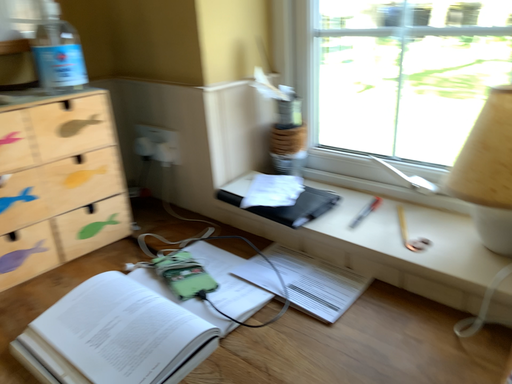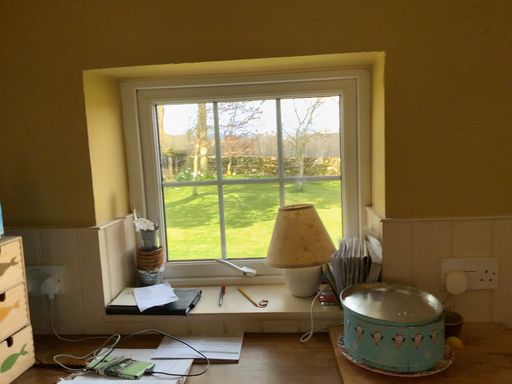
Question: Which way did the camera rotate in the video?

Choices:
 (A) rotated upward
 (B) rotated downward

Answer: (A)